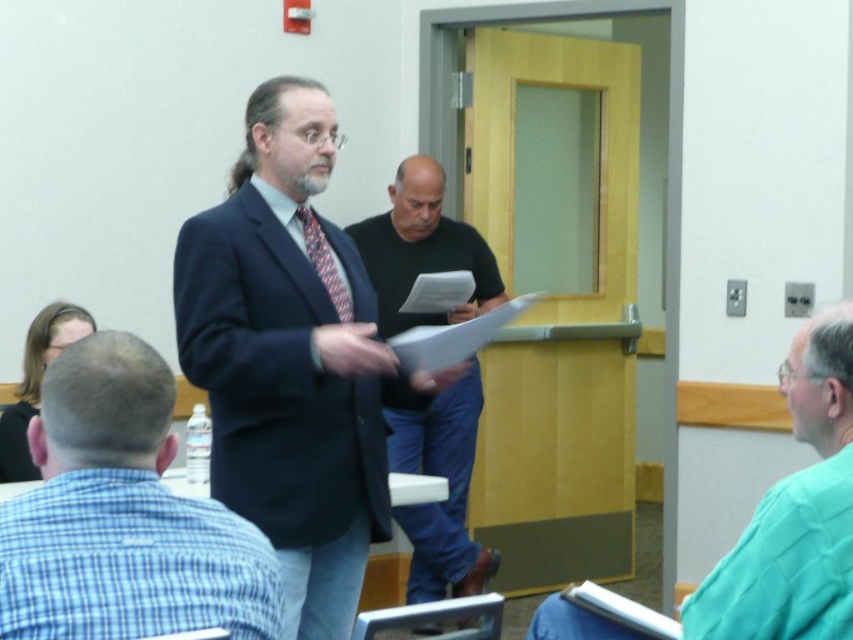
You are standing in the meeting room and want to determine which of the two points, point (303,436) or point (345,292), is closer to you. Based on the scene description, which point is nearer?

Point (303,436) is closer to the camera than point (345,292), so it is the nearer point.

Where is the green fabric shirt at right located in the image?

The green fabric shirt at right is located at point [795,513].

Consider the image. You are a photographer in the room. You want to take a photo of the white paper at center without the black cotton shirt at center blocking it. Is this possible?

The black cotton shirt at center is larger in size than white paper at center, so it would block the white paper at center. Therefore, it is not possible to take a photo of the white paper at center without the black cotton shirt at center blocking it.